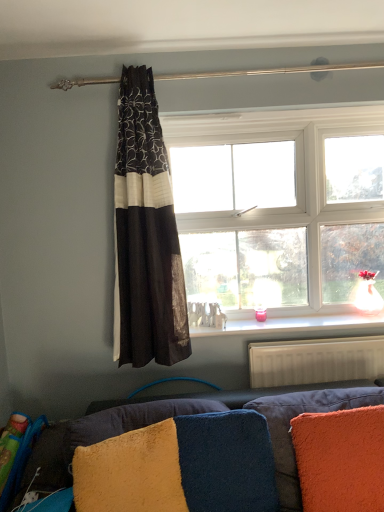
Question: Considering the relative sizes of black sheer curtain at center and orange fuzzy pillow at lower right, which is the third pillow in left-to-right order, in the image provided, is black sheer curtain at center wider than orange fuzzy pillow at lower right, which is the third pillow in left-to-right order,?

Choices:
 (A) no
 (B) yes

Answer: (B)

Question: Is black sheer curtain at center smaller than orange fuzzy pillow at lower right, positioned as the first pillow in right-to-left order?

Choices:
 (A) yes
 (B) no

Answer: (B)

Question: Is the position of black sheer curtain at center less distant than that of orange fuzzy pillow at lower right, positioned as the first pillow in right-to-left order?

Choices:
 (A) no
 (B) yes

Answer: (A)

Question: Is black sheer curtain at center further to the viewer compared to orange fuzzy pillow at lower right, which is the third pillow in left-to-right order?

Choices:
 (A) yes
 (B) no

Answer: (A)

Question: Can you confirm if black sheer curtain at center is shorter than orange fuzzy pillow at lower right, positioned as the first pillow in right-to-left order?

Choices:
 (A) yes
 (B) no

Answer: (B)

Question: From their relative heights in the image, would you say black sheer curtain at center is taller or shorter than velvet blue couch at lower center?

Choices:
 (A) tall
 (B) short

Answer: (A)

Question: Is black sheer curtain at center spatially inside velvet blue couch at lower center, or outside of it?

Choices:
 (A) outside
 (B) inside

Answer: (A)

Question: From the image's perspective, is black sheer curtain at center above or below velvet blue couch at lower center?

Choices:
 (A) above
 (B) below

Answer: (A)

Question: From a real-world perspective, is black sheer curtain at center above or below velvet blue couch at lower center?

Choices:
 (A) above
 (B) below

Answer: (A)

Question: Is point (324, 490) closer or farther from the camera than point (367, 394)?

Choices:
 (A) farther
 (B) closer

Answer: (B)

Question: Is orange fuzzy pillow at lower right, positioned as the first pillow in right-to-left order, bigger or smaller than velvet blue couch at lower center?

Choices:
 (A) big
 (B) small

Answer: (B)

Question: From their relative heights in the image, would you say orange fuzzy pillow at lower right, positioned as the first pillow in right-to-left order, is taller or shorter than velvet blue couch at lower center?

Choices:
 (A) short
 (B) tall

Answer: (A)

Question: From a real-world perspective, is orange fuzzy pillow at lower right, which is the third pillow in left-to-right order, above or below velvet blue couch at lower center?

Choices:
 (A) above
 (B) below

Answer: (A)

Question: From their relative heights in the image, would you say white textured radiator at lower right is taller or shorter than white plastic window at center?

Choices:
 (A) tall
 (B) short

Answer: (B)

Question: Looking at their shapes, would you say white textured radiator at lower right is wider or thinner than white plastic window at center?

Choices:
 (A) thin
 (B) wide

Answer: (A)